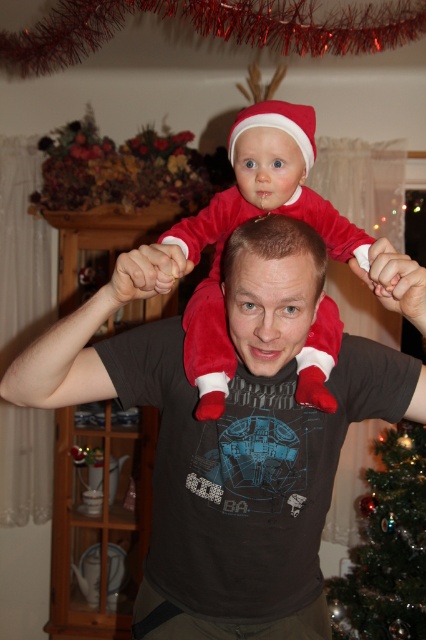
You are a photographer trying to capture both the velvet red santa suit at center and the shiny green christmas tree at lower right in a single frame. Which object should you focus on first to ensure both fit in the shot?

The velvet red santa suit at center is smaller than the shiny green christmas tree at lower right, so you should focus on the shiny green christmas tree at lower right first to ensure both fit in the shot.